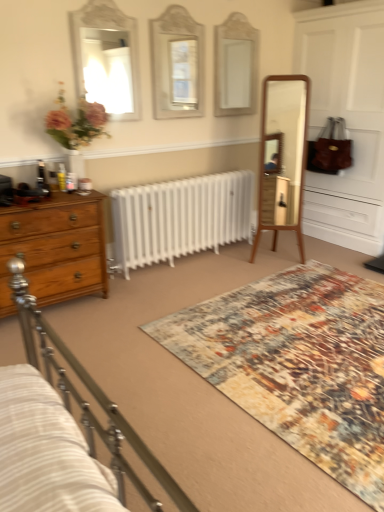
The height and width of the screenshot is (512, 384). I want to click on vacant space underneath white glass mirror at upper center, arranged as the third mirror when viewed from the left (from a real-world perspective), so click(x=231, y=134).